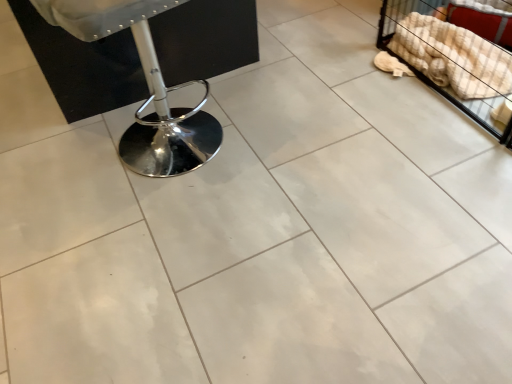
What are the coordinates of `free space below chrome metallic swivel chair at left (from a real-world perspective)` in the screenshot? It's located at (187, 128).